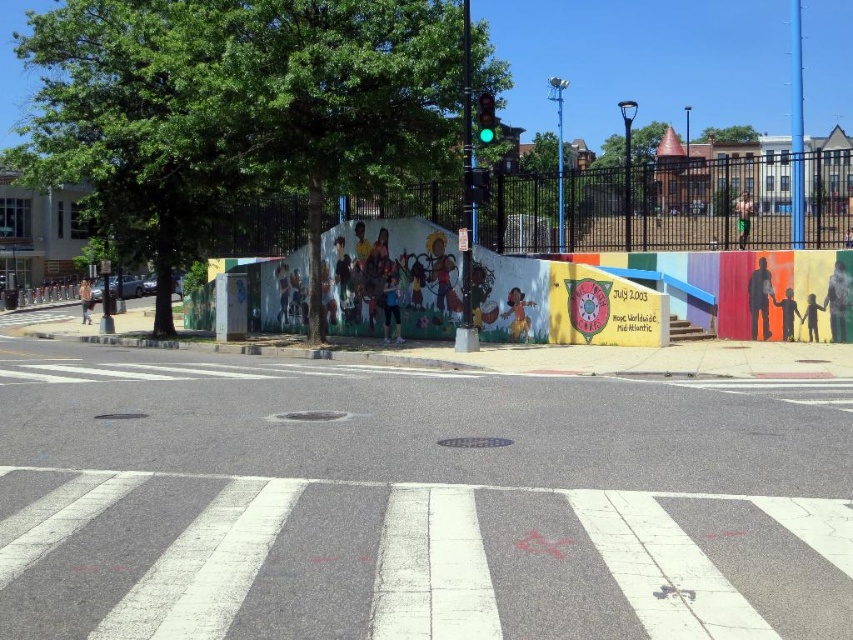
You are standing at the point marked as point (x=410, y=504) in the image. What surface are you currently standing on?

You are standing on the gray asphalt at center.